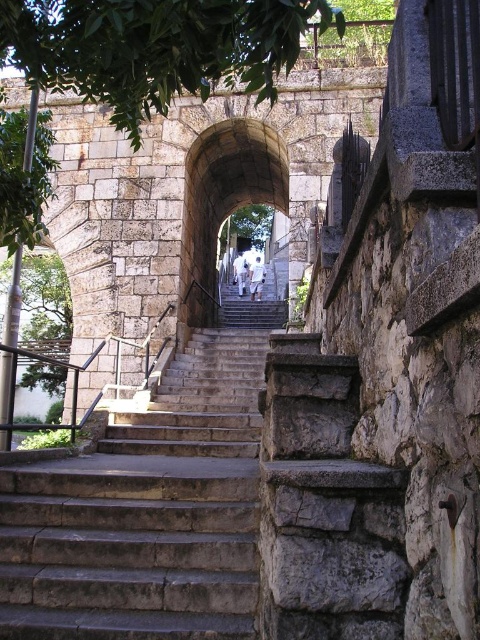
Question: Which point is closer to the camera taking this photo?

Choices:
 (A) pyautogui.click(x=328, y=13)
 (B) pyautogui.click(x=16, y=218)

Answer: (A)

Question: Can you confirm if stone stairs at center is positioned below green leafy tree at center?

Choices:
 (A) yes
 (B) no

Answer: (A)

Question: Is stone stairs at center above green leafy tree at left?

Choices:
 (A) no
 (B) yes

Answer: (A)

Question: Considering the real-world distances, which object is farthest from the green leafy tree at left?

Choices:
 (A) stone archway at center
 (B) green leafy tree at center
 (C) green leafy tree at upper left
 (D) stone stairs at center

Answer: (B)

Question: Which object appears closest to the camera in this image?

Choices:
 (A) green leafy tree at center
 (B) stone archway at center
 (C) green leafy tree at left
 (D) stone stairs at center

Answer: (D)

Question: Does stone archway at center lie behind green leafy tree at left?

Choices:
 (A) no
 (B) yes

Answer: (B)